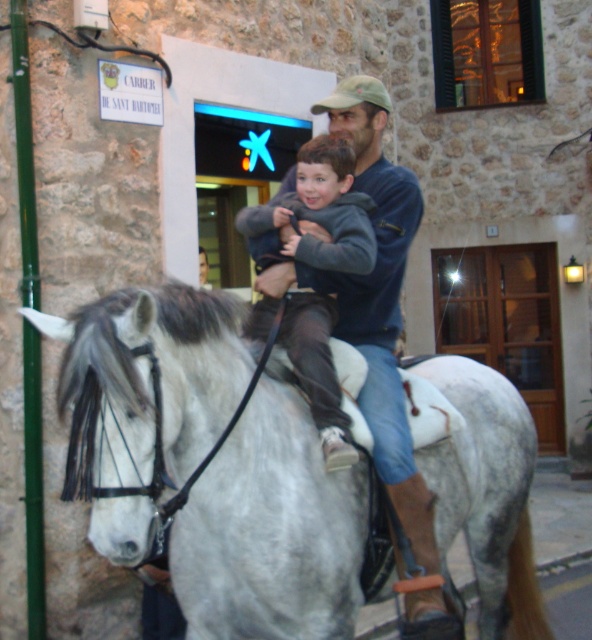
Question: Which object appears farthest from the camera in this image?

Choices:
 (A) gray fleece jacket at center
 (B) blue denim jacket at center

Answer: (B)

Question: Which is nearer to the gray matte/suede horse at center?

Choices:
 (A) gray fleece jacket at center
 (B) blue denim jacket at center

Answer: (A)

Question: Which of the following is the farthest from the observer?

Choices:
 (A) gray fleece jacket at center
 (B) blue denim jacket at center

Answer: (B)

Question: Does gray matte/suede horse at center appear on the left side of gray fleece jacket at center?

Choices:
 (A) yes
 (B) no

Answer: (A)

Question: Is gray matte/suede horse at center bigger than blue denim jacket at center?

Choices:
 (A) no
 (B) yes

Answer: (B)

Question: Is blue denim jacket at center bigger than gray fleece jacket at center?

Choices:
 (A) yes
 (B) no

Answer: (A)